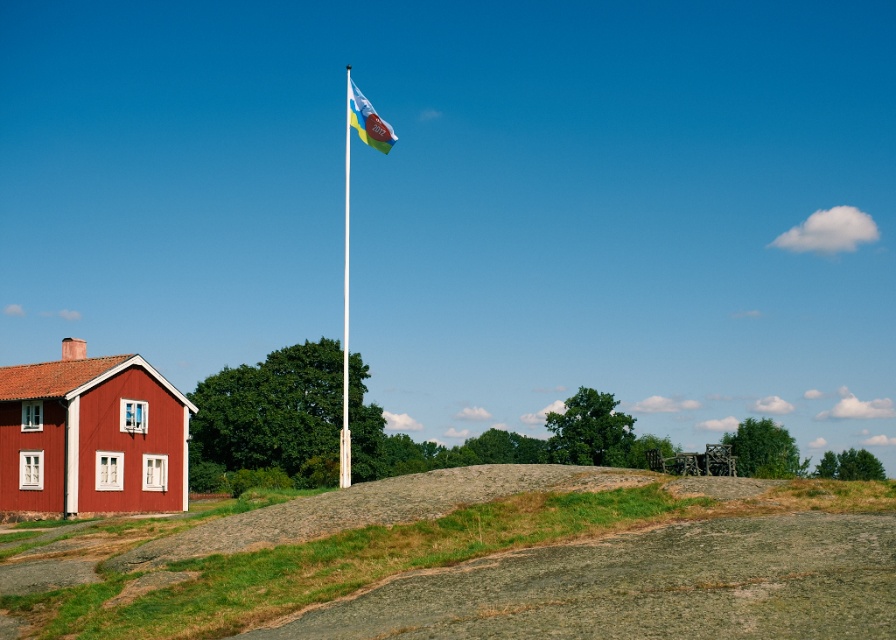
Looking at this image, you are a photographer planning to take a picture of the white glossy flag pole at center and the polyester flag at upper center. Given that the flag pole is larger than the flag, where should you position the camera to ensure both objects are fully visible in the frame?

Since the white glossy flag pole at center is larger than the polyester flag at upper center, position the camera closer to the flag pole to include its full size while still capturing the smaller polyester flag at upper center in the frame.

You are standing in the middle of the grassy hill and want to walk towards the white glossy flag pole at center and the polyester flag at upper center. Which object will you reach first?

You will reach the white glossy flag pole at center first because it is closer to you than the polyester flag at upper center.